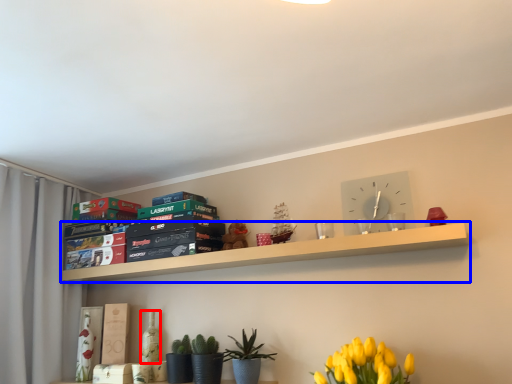
Question: Which of the following is the closest to the observer, bottle (highlighted by a red box) or shelf (highlighted by a blue box)?

Choices:
 (A) bottle
 (B) shelf

Answer: (B)